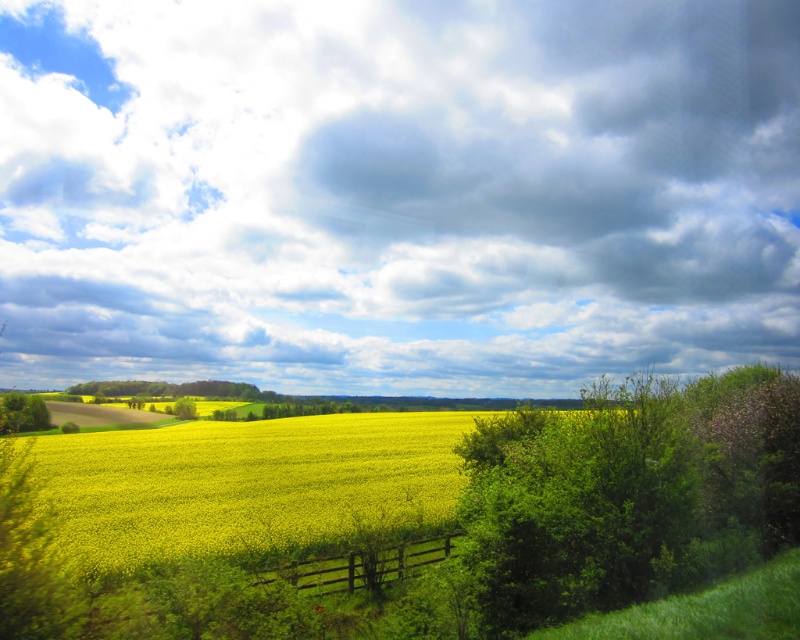
Measure the distance between cloudy sky at upper center and green leafy tree at center.

cloudy sky at upper center and green leafy tree at center are 108.12 meters apart.

Is point (16, 268) less distant than point (176, 406)?

No.

You are a GUI agent. You are given a task and a screenshot of the screen. Output one action in this format:
    pyautogui.click(x=<x>, y=<y>)
    Task: Click on the cloudy sky at upper center
    This screenshot has height=640, width=800.
    Given the screenshot: What is the action you would take?
    pyautogui.click(x=397, y=193)

Is green leafy bush at right positioned at the back of green leafy tree at lower left?

No, green leafy bush at right is in front of green leafy tree at lower left.

Does green leafy bush at right have a smaller size compared to green leafy tree at lower left?

Yes, green leafy bush at right is smaller than green leafy tree at lower left.

This screenshot has width=800, height=640. Describe the element at coordinates (628, 493) in the screenshot. I see `green leafy bush at right` at that location.

I want to click on green leafy bush at right, so click(x=628, y=493).

Which of these two, brown wooden fence at center or green leafy tree at center, stands shorter?

green leafy tree at center

Locate an element on the screen. The image size is (800, 640). brown wooden fence at center is located at coordinates (362, 566).